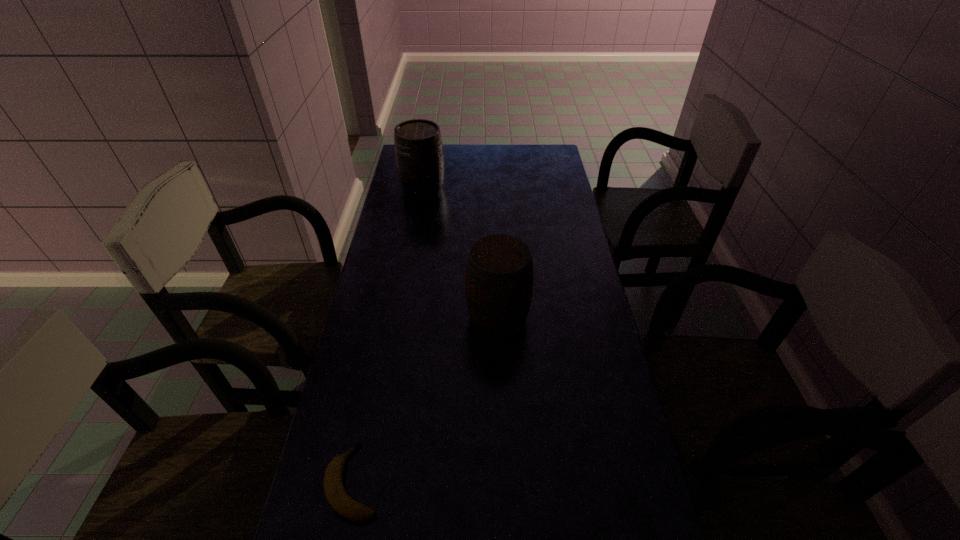
Locate an element on the screen. The image size is (960, 540). free spot that satisfies the following two spatial constraints: 1. on the side of the rightmost object near the bung hole; 2. on the right side of the farthest object is located at coordinates (401, 317).